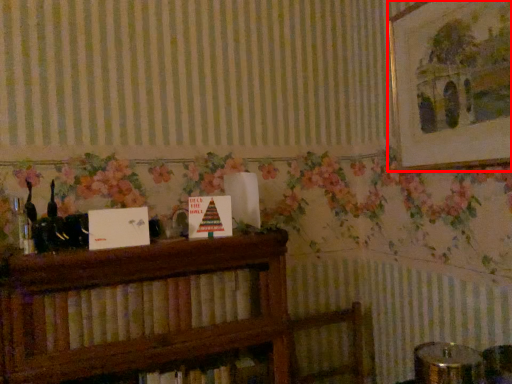
Question: Observing the image, what is the correct spatial positioning of picture frame (annotated by the red box) in reference to book?

Choices:
 (A) right
 (B) left

Answer: (A)